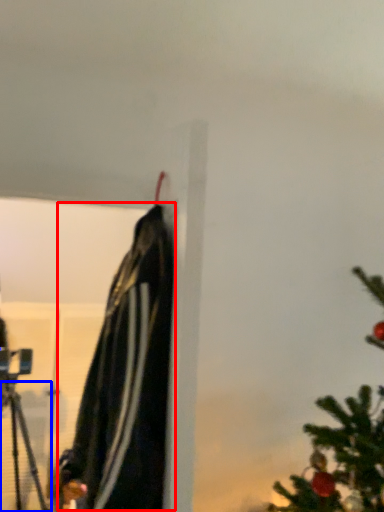
Question: Which object is further to the camera taking this photo, cloak (highlighted by a red box) or tripod (highlighted by a blue box)?

Choices:
 (A) cloak
 (B) tripod

Answer: (B)